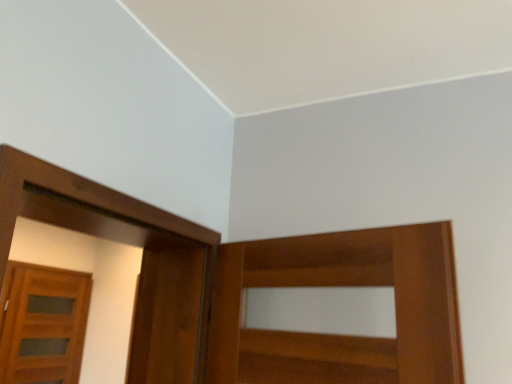
What do you see at coordinates (42, 324) in the screenshot? The height and width of the screenshot is (384, 512). I see `matte brown door at left` at bounding box center [42, 324].

What is the approximate width of matte brown door at left?

3.11 inches.

Locate an element on the screen. matte brown door at left is located at coordinates (42, 324).

From the picture: Measure the distance between point (42, 271) and camera.

A distance of 10.55 feet exists between point (42, 271) and camera.

I want to click on matte brown door at left, so click(x=42, y=324).